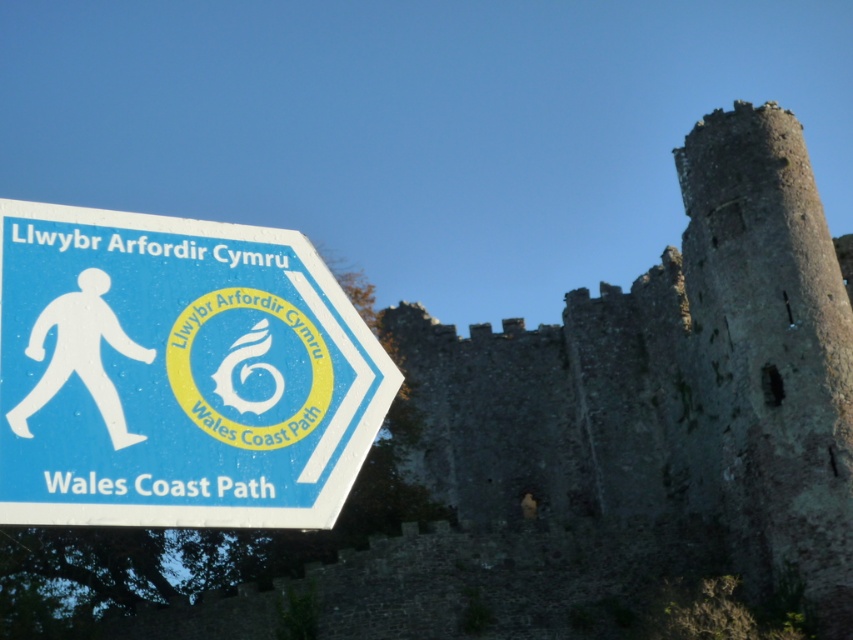
You are a hiker who just arrived at the Wales Coast Path. You see the gray stone castle at center and the blue plastic sign at left. Which object is taller?

The gray stone castle at center is much taller than the blue plastic sign at left.

From the picture: You are a hiker who just arrived at the Wales Coast Path. You see the gray stone castle at center and the blue plastic sign at left. Which object is closer to you?

The gray stone castle at center is closer to you because it is further to the viewer than the blue plastic sign at left.

You are a hiker who wants to know which object in the scene is bigger. You see the gray stone castle at center and the blue plastic sign at left. Which one is larger?

The gray stone castle at center has a larger size compared to the blue plastic sign at left, so the gray stone castle at center is bigger.